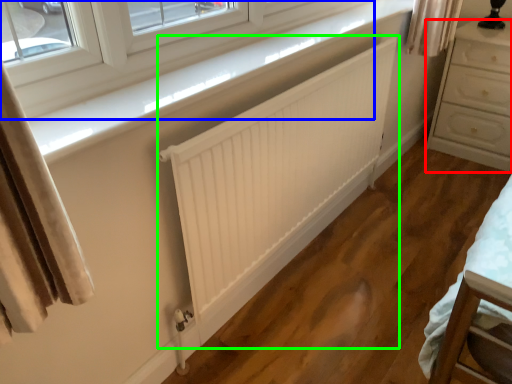
Question: Which object is the farthest from chest of drawers (highlighted by a red box)? Choose among these: window (highlighted by a blue box) or radiator (highlighted by a green box).

Choices:
 (A) window
 (B) radiator

Answer: (A)